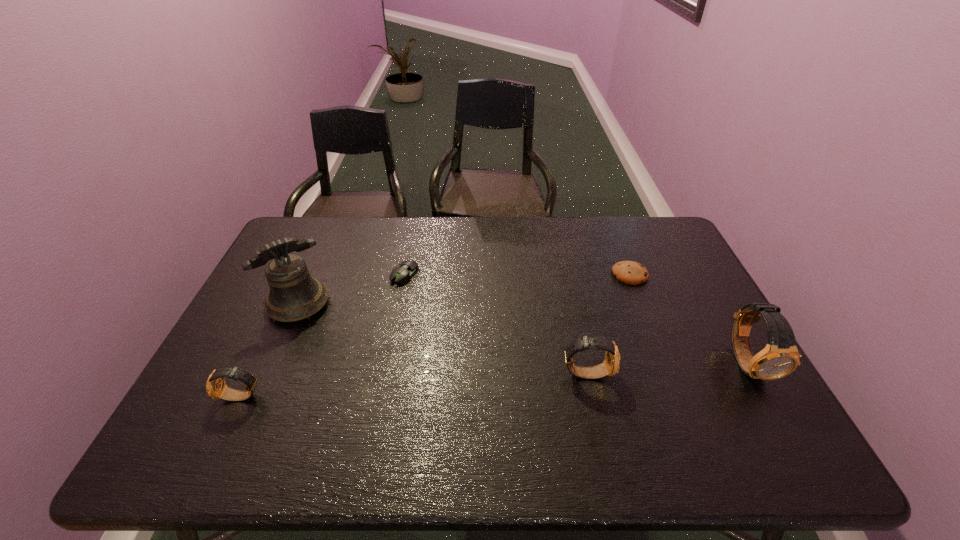
Identify the location of the third shortest object. This screenshot has width=960, height=540. (216, 387).

What are the coordinates of `the shortest watch` in the screenshot? It's located at (216, 387).

The width and height of the screenshot is (960, 540). Identify the location of the third tallest object. (611, 365).

At what (x,y) coordinates should I click in order to perform the action: click on the second watch from left to right. Please return your answer as a coordinate pair (x, y). Looking at the image, I should click on (611, 365).

Where is `the second tallest object`? The image size is (960, 540). the second tallest object is located at coordinates (780, 357).

This screenshot has width=960, height=540. In order to click on the rightmost watch in this screenshot , I will do `click(780, 357)`.

The image size is (960, 540). Identify the location of bell. (294, 295).

This screenshot has height=540, width=960. I want to click on computer mouse, so click(401, 274).

Where is `cookie`? The image size is (960, 540). cookie is located at coordinates (629, 272).

Locate an element on the screen. vacant space located on the face of the second watch from right to left is located at coordinates (695, 373).